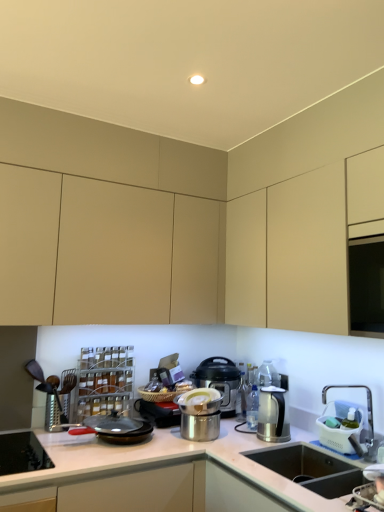
Find the location of a particular element. matte beige cabinet at upper center, the second cabinetry positioned from the front is located at coordinates (112, 252).

This screenshot has width=384, height=512. Find the location of `silver metallic faucet at lower right`. silver metallic faucet at lower right is located at coordinates (346, 416).

Identify the location of matte beige cabinet at center, acting as the 2th cabinetry starting from the back. (185, 216).

Considering the relative sizes of matte black pressure cooker at center, arranged as the first kitchen appliance when viewed from the back, and white glossy countertop at center in the image provided, is matte black pressure cooker at center, arranged as the first kitchen appliance when viewed from the back, taller than white glossy countertop at center?

In fact, matte black pressure cooker at center, arranged as the first kitchen appliance when viewed from the back, may be shorter than white glossy countertop at center.

From a real-world perspective, who is located higher, matte black pressure cooker at center, which is counted as the 3th kitchen appliance, starting from the front, or white glossy countertop at center?

matte black pressure cooker at center, which is counted as the 3th kitchen appliance, starting from the front, from a real-world perspective.

Locate an element on the screen. This screenshot has height=512, width=384. countertop on the left of matte black pressure cooker at center, which is counted as the 3th kitchen appliance, starting from the front is located at coordinates click(160, 476).

Is matte black pressure cooker at center, which is counted as the 3th kitchen appliance, starting from the front, located outside white glossy countertop at center?

Yes, matte black pressure cooker at center, which is counted as the 3th kitchen appliance, starting from the front, is not within white glossy countertop at center.

How many degrees apart are the facing directions of black non-stick frying pan at center and matte beige cabinet at center, the 1th cabinetry in the front-to-back sequence?

They differ by 1.93 degrees in their facing directions.

Is black non-stick frying pan at center turned away from matte beige cabinet at center, acting as the 2th cabinetry starting from the back?

No, matte beige cabinet at center, acting as the 2th cabinetry starting from the back, is not at the back of black non-stick frying pan at center.

The height and width of the screenshot is (512, 384). I want to click on frying pan behind the matte beige cabinet at center, the 1th cabinetry in the front-to-back sequence, so click(115, 428).

How distant is black non-stick frying pan at center from matte beige cabinet at center, the 1th cabinetry in the front-to-back sequence?

The distance of black non-stick frying pan at center from matte beige cabinet at center, the 1th cabinetry in the front-to-back sequence, is 3.28 feet.

Is brushed metal stove at lower left with matte beige cabinet at upper center, which is counted as the first cabinetry, starting from the back?

No, brushed metal stove at lower left is not touching matte beige cabinet at upper center, which is counted as the first cabinetry, starting from the back.

Is brushed metal stove at lower left inside the boundaries of matte beige cabinet at upper center, the second cabinetry positioned from the front, or outside?

brushed metal stove at lower left is outside matte beige cabinet at upper center, the second cabinetry positioned from the front.

Considering the relative sizes of brushed metal stove at lower left and matte beige cabinet at upper center, which is counted as the first cabinetry, starting from the back, in the image provided, is brushed metal stove at lower left smaller than matte beige cabinet at upper center, which is counted as the first cabinetry, starting from the back,?

Yes.

In the scene shown: Considering the positions of objects matte beige cabinet at upper center, the second cabinetry positioned from the front, and matte black pressure cooker at center, arranged as the first kitchen appliance when viewed from the back, in the image provided, who is behind, matte beige cabinet at upper center, the second cabinetry positioned from the front, or matte black pressure cooker at center, arranged as the first kitchen appliance when viewed from the back,?

Positioned behind is matte black pressure cooker at center, arranged as the first kitchen appliance when viewed from the back.

Is matte beige cabinet at upper center, the second cabinetry positioned from the front, outside of matte black pressure cooker at center, arranged as the first kitchen appliance when viewed from the back?

That's correct, matte beige cabinet at upper center, the second cabinetry positioned from the front, is outside of matte black pressure cooker at center, arranged as the first kitchen appliance when viewed from the back.

Which is more to the left, matte beige cabinet at upper center, the second cabinetry positioned from the front, or matte black pressure cooker at center, arranged as the first kitchen appliance when viewed from the back?

matte beige cabinet at upper center, the second cabinetry positioned from the front.

Are matte beige cabinet at upper center, which is counted as the first cabinetry, starting from the back, and matte black pressure cooker at center, which is counted as the 3th kitchen appliance, starting from the front, beside each other?

They are not placed beside each other.

From a real-world perspective, is matte black pressure cooker at center, arranged as the first kitchen appliance when viewed from the back, on satin silver kettle at right, which is the 2th kitchen appliance in front-to-back order?

Indeed, from a real-world perspective, matte black pressure cooker at center, arranged as the first kitchen appliance when viewed from the back, stands above satin silver kettle at right, which is the 2th kitchen appliance in front-to-back order.

Is matte black pressure cooker at center, which is counted as the 3th kitchen appliance, starting from the front, further to camera compared to satin silver kettle at right, which is the 2th kitchen appliance in front-to-back order?

Yes, it is behind satin silver kettle at right, which is the 2th kitchen appliance in front-to-back order.

Is matte black pressure cooker at center, arranged as the first kitchen appliance when viewed from the back, with satin silver kettle at right, which is the 2th kitchen appliance in front-to-back order?

There is a gap between matte black pressure cooker at center, arranged as the first kitchen appliance when viewed from the back, and satin silver kettle at right, which is the 2th kitchen appliance in front-to-back order.

Is matte black pressure cooker at center, which is counted as the 3th kitchen appliance, starting from the front, oriented towards satin silver kettle at right, which is the 2th kitchen appliance in front-to-back order?

Yes, matte black pressure cooker at center, which is counted as the 3th kitchen appliance, starting from the front, is turned towards satin silver kettle at right, which is the 2th kitchen appliance in front-to-back order.

Where is `faucet that appears above the black non-stick frying pan at center (from the image's perspective)`? faucet that appears above the black non-stick frying pan at center (from the image's perspective) is located at coordinates (346, 416).

Considering the positions of point (332, 394) and point (114, 432), is point (332, 394) closer or farther from the camera than point (114, 432)?

Point (332, 394).

From a real-world perspective, who is located higher, silver metallic faucet at lower right or black non-stick frying pan at center?

silver metallic faucet at lower right.

Does brushed metal grater at left turn towards matte black pressure cooker at center, arranged as the first kitchen appliance when viewed from the back?

No.

Is brushed metal grater at left wider than matte black pressure cooker at center, which is counted as the 3th kitchen appliance, starting from the front?

Incorrect, the width of brushed metal grater at left does not surpass that of matte black pressure cooker at center, which is counted as the 3th kitchen appliance, starting from the front.

Can you see brushed metal grater at left touching matte black pressure cooker at center, arranged as the first kitchen appliance when viewed from the back?

No, brushed metal grater at left is not next to matte black pressure cooker at center, arranged as the first kitchen appliance when viewed from the back.

Considering the relative sizes of brushed metal grater at left and matte black pressure cooker at center, which is counted as the 3th kitchen appliance, starting from the front, in the image provided, is brushed metal grater at left smaller than matte black pressure cooker at center, which is counted as the 3th kitchen appliance, starting from the front,?

Yes.

This screenshot has height=512, width=384. I want to click on the 3rd kitchen appliance behind the white glossy countertop at center, so click(x=219, y=381).

From the image's perspective, starting from the black non-stick frying pan at center, which cabinetry is the 2nd one above? Please provide its 2D coordinates.

[(185, 216)]

Which object lies further to the anchor point matte beige cabinet at center, acting as the 2th cabinetry starting from the back, polished stainless steel pot at center, the third kitchen appliance viewed from the back, or satin silver kettle at right, marked as the 2th kitchen appliance in a back-to-front arrangement?

Based on the image, satin silver kettle at right, marked as the 2th kitchen appliance in a back-to-front arrangement, appears to be further to matte beige cabinet at center, acting as the 2th cabinetry starting from the back.

Looking at the image, which one is located closer to polished stainless steel pot at center, the first kitchen appliance viewed from the front, brushed metal grater at left or matte beige cabinet at center, the 1th cabinetry in the front-to-back sequence?

brushed metal grater at left is positioned closer to the anchor polished stainless steel pot at center, the first kitchen appliance viewed from the front.

From the image, which object appears to be nearer to matte beige cabinet at upper center, the second cabinetry positioned from the front, matte black pressure cooker at center, which is counted as the 3th kitchen appliance, starting from the front, or white glossy countertop at center?

Among the two, matte black pressure cooker at center, which is counted as the 3th kitchen appliance, starting from the front, is located nearer to matte beige cabinet at upper center, the second cabinetry positioned from the front.

Based on their spatial positions, is matte black pressure cooker at center, which is counted as the 3th kitchen appliance, starting from the front, or brushed metal grater at left closer to matte beige cabinet at center, the 1th cabinetry in the front-to-back sequence?

matte black pressure cooker at center, which is counted as the 3th kitchen appliance, starting from the front, is closer to matte beige cabinet at center, the 1th cabinetry in the front-to-back sequence.

From the image, which object appears to be nearer to silver metallic faucet at lower right, black non-stick frying pan at center or matte black pressure cooker at center, arranged as the first kitchen appliance when viewed from the back?

Among the two, matte black pressure cooker at center, arranged as the first kitchen appliance when viewed from the back, is located nearer to silver metallic faucet at lower right.

From the image, which object appears to be farther from brushed metal grater at left, white glossy countertop at center or silver metallic faucet at lower right?

silver metallic faucet at lower right lies further to brushed metal grater at left than the other object.

Which object lies further to the anchor point brushed metal grater at left, polished stainless steel pot at center, the first kitchen appliance viewed from the front, or matte black pressure cooker at center, arranged as the first kitchen appliance when viewed from the back?

Among the two, matte black pressure cooker at center, arranged as the first kitchen appliance when viewed from the back, is located further to brushed metal grater at left.

When comparing their distances from matte beige cabinet at upper center, which is counted as the first cabinetry, starting from the back, does brushed metal stove at lower left or satin silver kettle at right, which is the 2th kitchen appliance in front-to-back order, seem closer?

brushed metal stove at lower left is closer to matte beige cabinet at upper center, which is counted as the first cabinetry, starting from the back.

Identify the location of cabinetry between matte beige cabinet at center, the 1th cabinetry in the front-to-back sequence, and brushed metal grater at left, along the z-axis. (112, 252).

Find the location of a particular element. This screenshot has width=384, height=512. frying pan situated between brushed metal grater at left and polished stainless steel pot at center, the third kitchen appliance viewed from the back, from left to right is located at coordinates coord(115,428).

The width and height of the screenshot is (384, 512). What are the coordinates of `frying pan positioned between white glossy countertop at center and brushed metal grater at left from near to far` in the screenshot? It's located at (115, 428).

The width and height of the screenshot is (384, 512). Find the location of `appliance between matte beige cabinet at upper center, which is counted as the first cabinetry, starting from the back, and black non-stick frying pan at center vertically`. appliance between matte beige cabinet at upper center, which is counted as the first cabinetry, starting from the back, and black non-stick frying pan at center vertically is located at coordinates (45, 385).